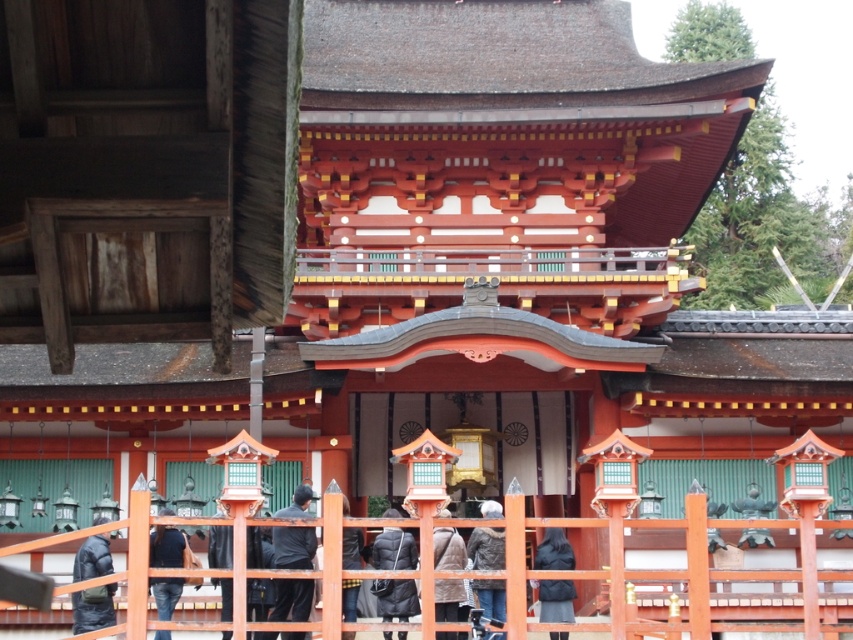
You are standing in front of the shrine and see both the gray woolen jacket at center and the dark gray fabric jacket at lower center. Which jacket is positioned to the left?

The gray woolen jacket at center is positioned to the left of the dark gray fabric jacket at lower center.

You are standing in front of the shrine and see both the black puffer jacket at center and the dark gray fabric jacket at lower center. Which jacket is positioned to the left of the other?

The black puffer jacket at center is positioned to the left of the dark gray fabric jacket at lower center.